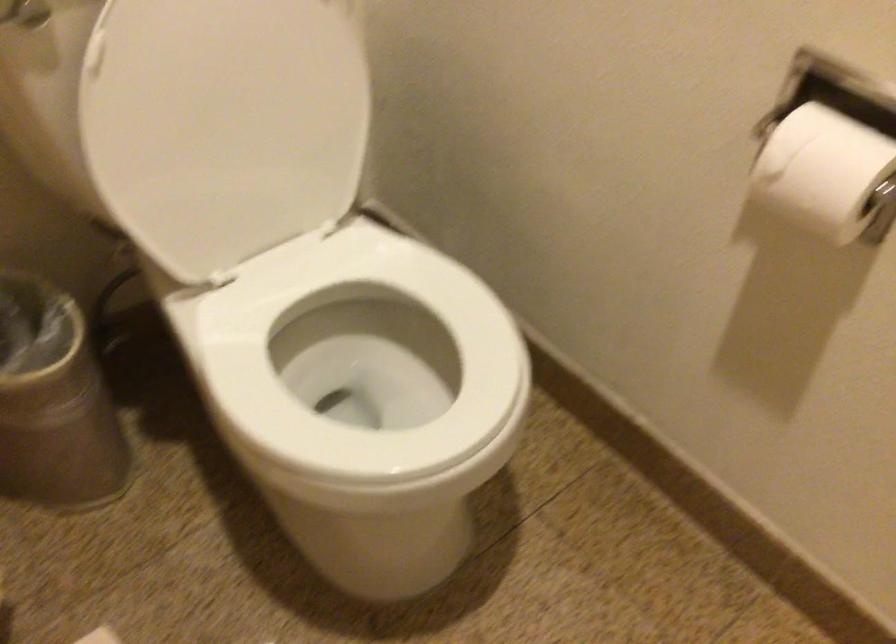
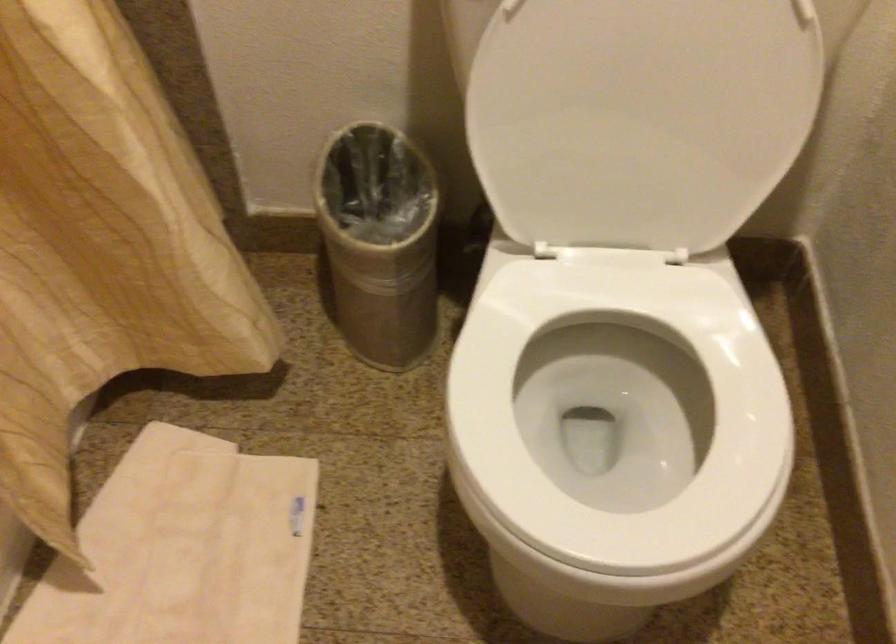
Question: The images are taken continuously from a first-person perspective. In which direction is your viewpoint rotating?

Choices:
 (A) Left
 (B) Right
 (C) Up
 (D) Down

Answer: (A)